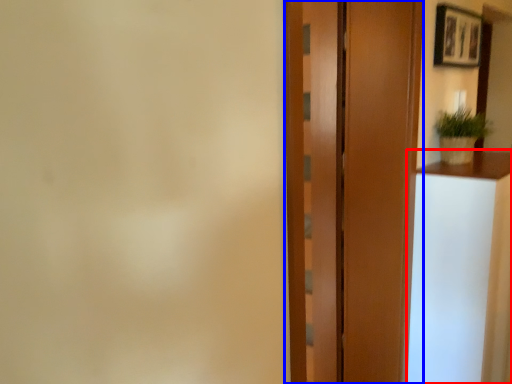
Question: Which object is further to the camera taking this photo, vanity (highlighted by a red box) or door (highlighted by a blue box)?

Choices:
 (A) vanity
 (B) door

Answer: (A)